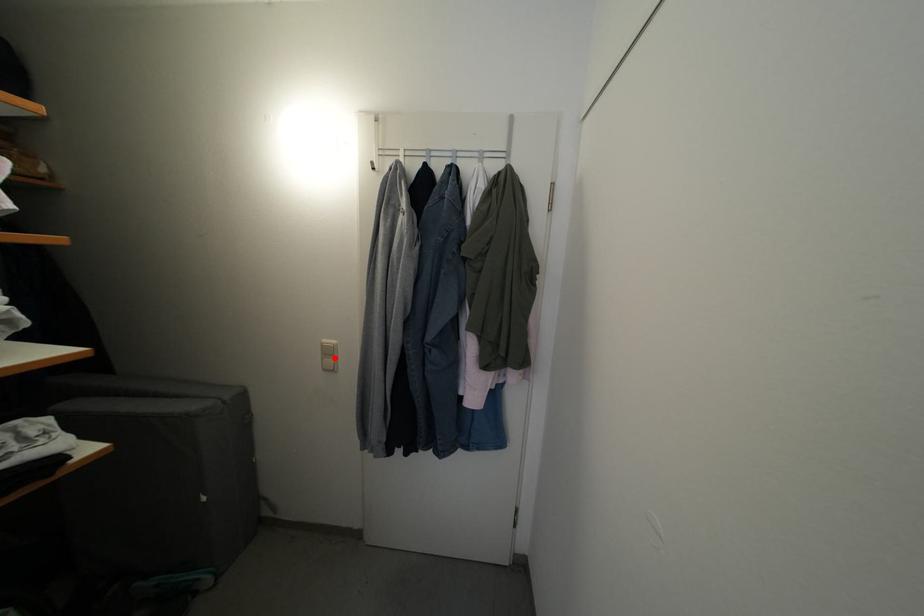
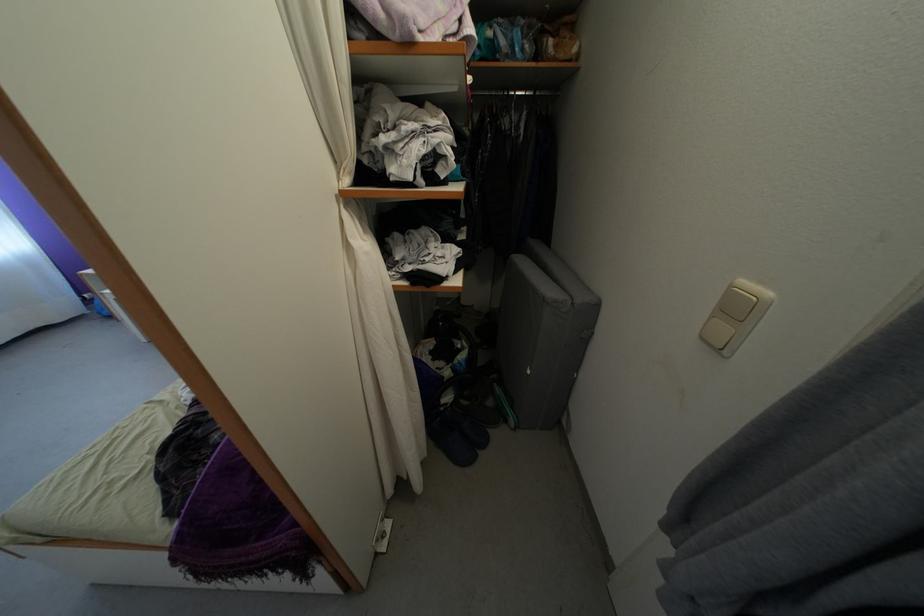
Where in the second image is the point corresponding to the highlighted location from the first image?

(743, 315)